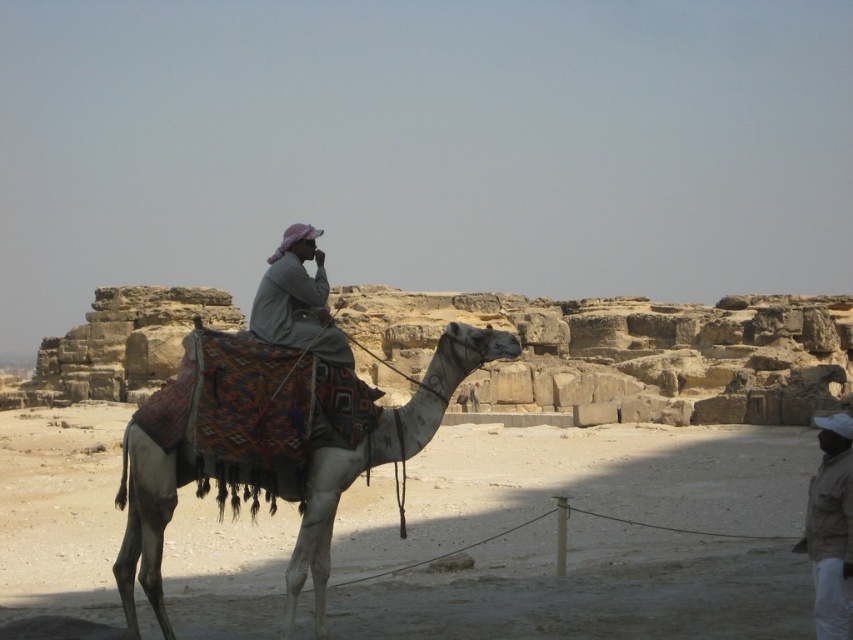
Question: Can you confirm if white textured camel at center is smaller than light beige fabric at center?

Choices:
 (A) yes
 (B) no

Answer: (B)

Question: Considering the real-world distances, which object is closest to the light beige fabric at center?

Choices:
 (A) tan fabric jacket at lower right
 (B) white textured camel at center

Answer: (B)

Question: Which object appears farthest from the camera in this image?

Choices:
 (A) white textured camel at center
 (B) light beige fabric at center
 (C) tan fabric jacket at lower right

Answer: (B)

Question: Can you confirm if white textured camel at center is wider than tan fabric jacket at lower right?

Choices:
 (A) yes
 (B) no

Answer: (A)

Question: Can you confirm if white textured camel at center is smaller than tan fabric jacket at lower right?

Choices:
 (A) yes
 (B) no

Answer: (B)

Question: Which of the following is the farthest from the observer?

Choices:
 (A) white textured camel at center
 (B) tan fabric jacket at lower right
 (C) light beige fabric at center

Answer: (C)